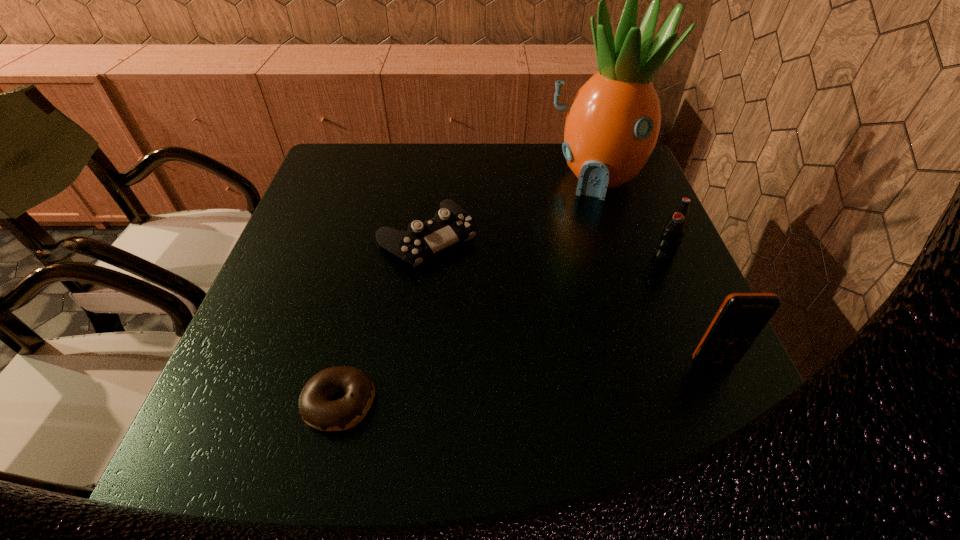
Find the location of a particular element. Image resolution: width=960 pixels, height=540 pixels. vacant space at the far left corner of the desktop is located at coordinates click(366, 178).

You are a GUI agent. You are given a task and a screenshot of the screen. Output one action in this format:
    pyautogui.click(x=<x>, y=<y>)
    Task: Click on the vacant space at the near left corner
    
    Given the screenshot: What is the action you would take?
    pyautogui.click(x=206, y=408)

The image size is (960, 540). I want to click on free location at the near right corner, so click(x=706, y=421).

Locate an element on the screen. The width and height of the screenshot is (960, 540). vacant space that is in between the pop and the cellular telephone is located at coordinates (688, 309).

Locate an element on the screen. Image resolution: width=960 pixels, height=540 pixels. free space between the control and the pop is located at coordinates (545, 248).

What are the coordinates of `free point between the third shortest object and the fourth farthest object` in the screenshot? It's located at [x=688, y=309].

Identify the location of free space between the shortest object and the pop. This screenshot has height=540, width=960. (502, 329).

Locate an element on the screen. The width and height of the screenshot is (960, 540). unoccupied area between the cellular telephone and the third shortest object is located at coordinates (688, 309).

At what (x,y) coordinates should I click in order to perform the action: click on unoccupied position between the control and the cellular telephone. Please return your answer as a coordinate pair (x, y). Looking at the image, I should click on (570, 300).

Locate an element on the screen. free spot between the second nearest object and the control is located at coordinates (570, 300).